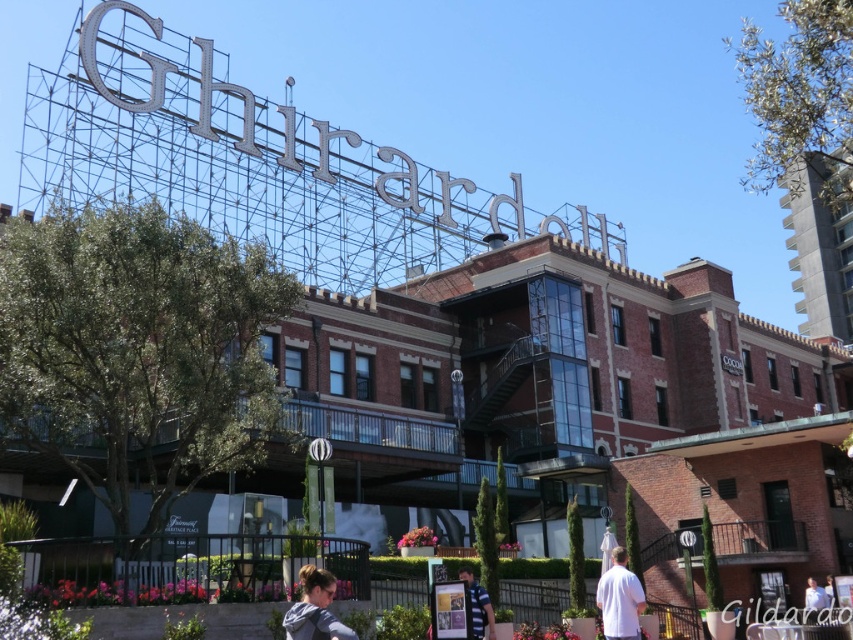
You are a photographer wanting to capture both the white matte shirt at lower right and the blue striped shirt at center in a single frame. Which shirt should you focus on first to ensure both are in the frame?

The white matte shirt at lower right is taller than the blue striped shirt at center, so focus on the white matte shirt at lower right first to ensure both are captured in the frame.

You are attending an outdoor event near the Ghirardelli building and notice two people wearing the white matte shirt at lower right and the blue striped shirt at center. If you were to estimate their clothing sizes, which shirt is wider?

The white matte shirt at lower right is wider than the blue striped shirt at center according to their widths.

Consider the image. You are a photographer trying to capture a portrait of someone standing in front of the Ghirardelli building. You notice the blonde hair at lower center and the white matte shirt at lower right. Which object should you focus on if you want to highlight something smaller in the scene?

The blonde hair at lower center should be focused on because it has a smaller size compared to the white matte shirt at lower right.